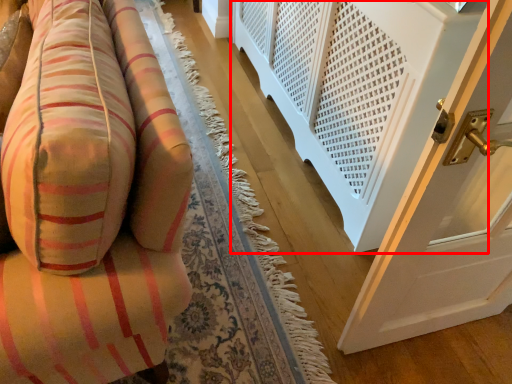
Question: From the image's perspective, what is the correct spatial relationship of balustrade (annotated by the red box) in relation to furniture?

Choices:
 (A) below
 (B) above

Answer: (B)